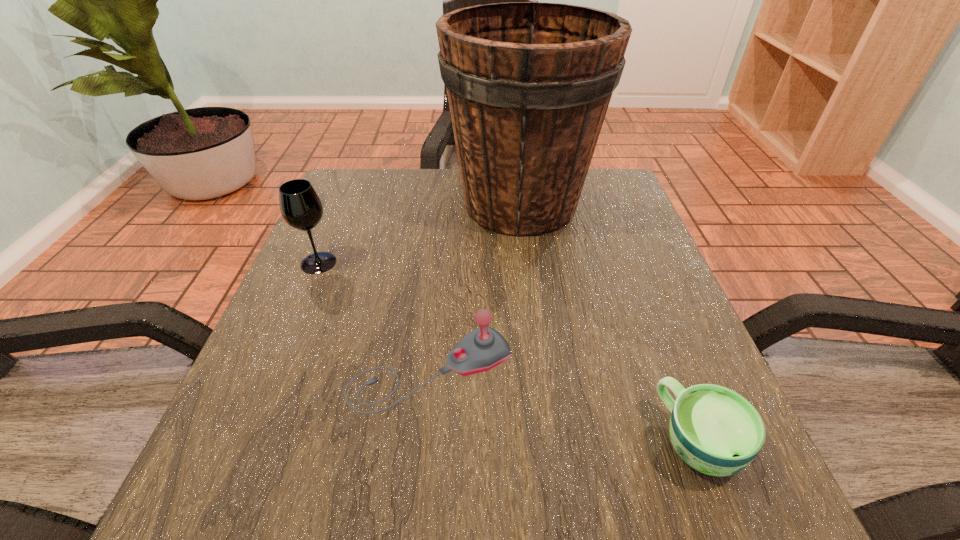
What are the coordinates of `free spot between the shortest object and the bucket` in the screenshot? It's located at (609, 322).

The height and width of the screenshot is (540, 960). I want to click on free spot between the second farthest object and the joystick, so click(x=374, y=316).

Where is `empty space between the farthest object and the cup`? The image size is (960, 540). empty space between the farthest object and the cup is located at coordinates (609, 322).

You are a GUI agent. You are given a task and a screenshot of the screen. Output one action in this format:
    pyautogui.click(x=<x>, y=<y>)
    Task: Click on the vacant space that is in between the cup and the tallest object
    The image size is (960, 540).
    Given the screenshot: What is the action you would take?
    click(x=609, y=322)

Where is `object that is the second closest to the tallest object`? The height and width of the screenshot is (540, 960). object that is the second closest to the tallest object is located at coordinates (x=484, y=348).

Find the location of a particular element. The width and height of the screenshot is (960, 540). object that is the closest to the cup is located at coordinates (484, 348).

At what (x,y) coordinates should I click in order to perform the action: click on free space that satisfies the following two spatial constraints: 1. on the front side of the cup; 2. on the left side of the farthest object. Please return your answer as a coordinate pair (x, y). Looking at the image, I should click on (549, 441).

Find the location of a particular element. The height and width of the screenshot is (540, 960). free space that satisfies the following two spatial constraints: 1. on the front side of the second shortest object; 2. on the right side of the cup is located at coordinates (424, 441).

At what (x,y) coordinates should I click in order to perform the action: click on vacant space that satisfies the following two spatial constraints: 1. on the back side of the joystick; 2. on the left side of the tallest object. Please return your answer as a coordinate pair (x, y). Looking at the image, I should click on (x=447, y=205).